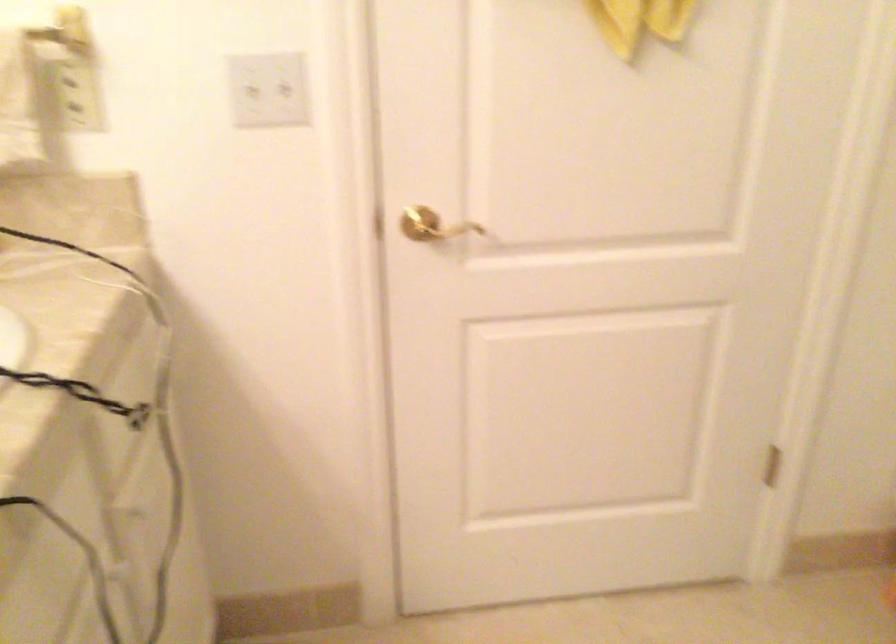
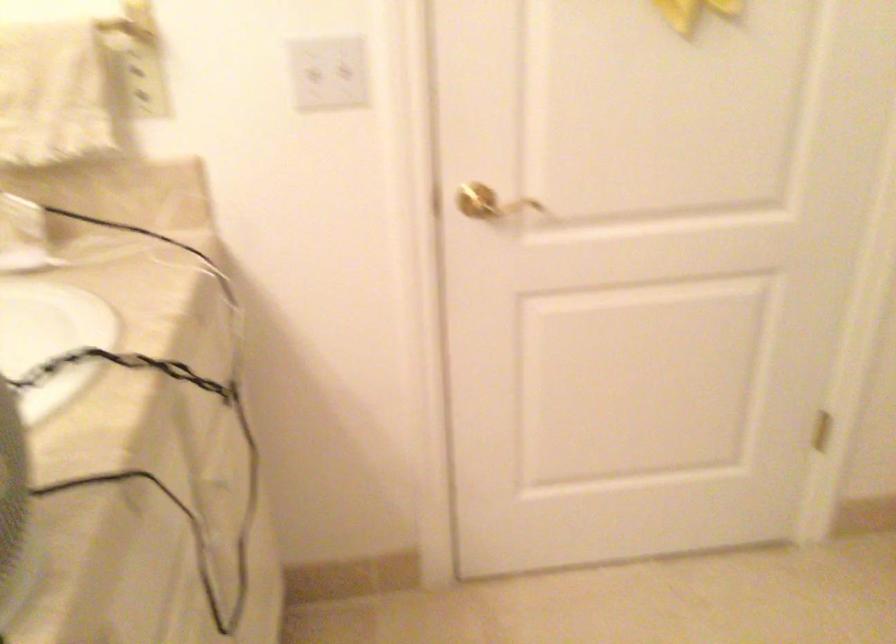
Question: How did the camera likely rotate?

Choices:
 (A) Left
 (B) Right
 (C) Up
 (D) Down

Answer: (D)